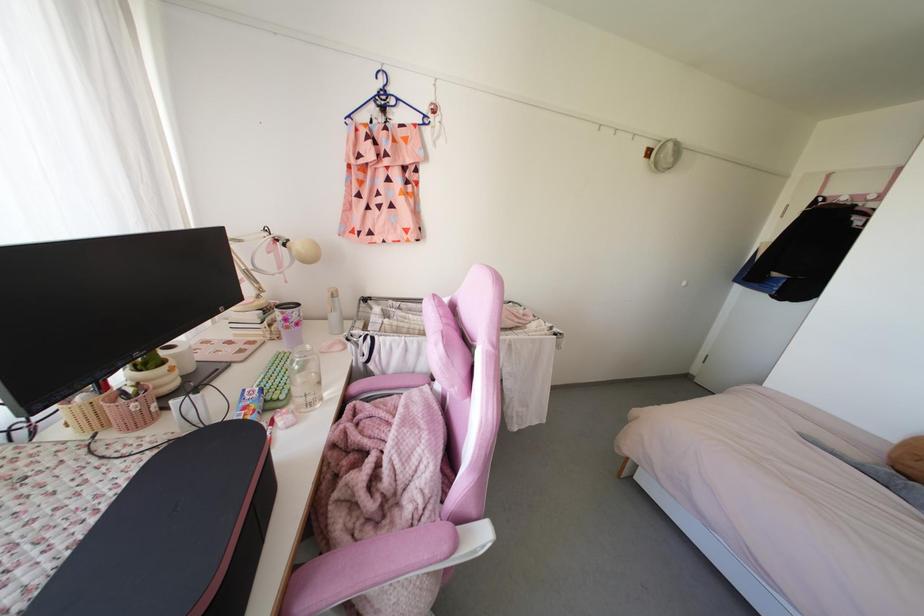
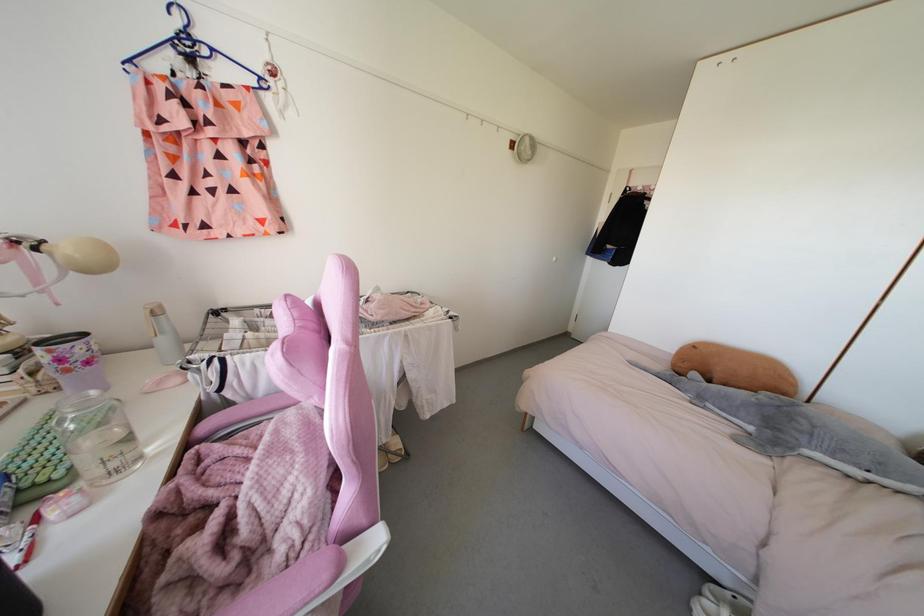
Find the pixel in the second image that matches point (307, 346) in the first image.

(92, 392)